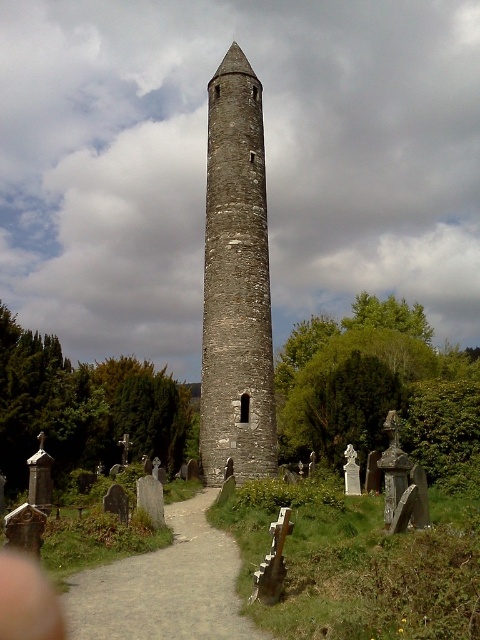
You are standing at the point with coordinates [236,282] in the image. Based on the scene description, what object are you directly positioned at?

The point at coordinates [236,282] corresponds to the gray stone tower at center, so you are directly positioned at the gray stone tower at center.

Based on the photo, you are standing at the entrance of the cemetery and see two points marked in the image. Which point is closer to you, point [271,355] or point [212,637]?

Point [212,637] is closer to you because it is in front of point [271,355], which is behind it.